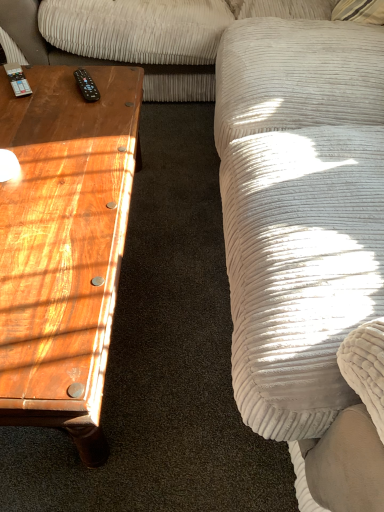
What are the coordinates of `free space to the left of black plastic remote at upper left` in the screenshot? It's located at (42, 94).